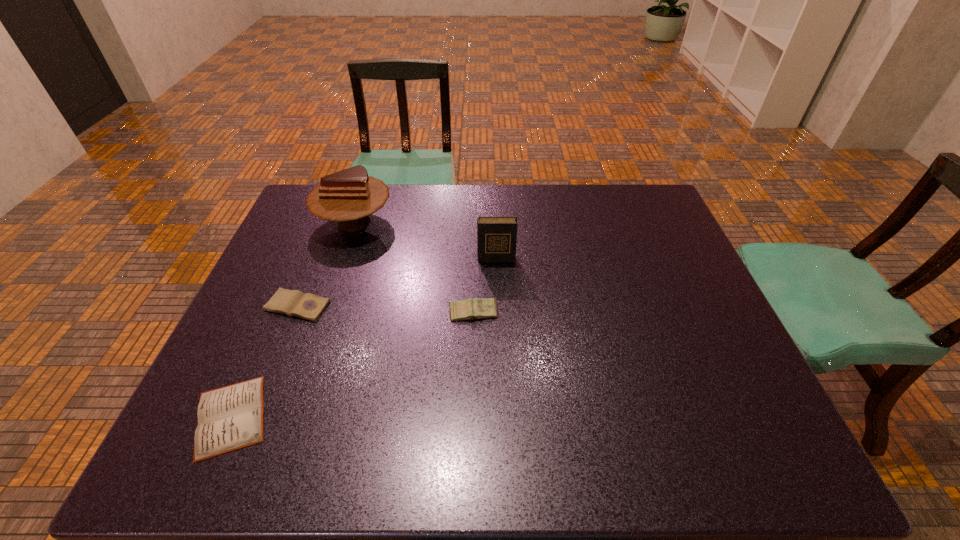
Find the location of a particular element. This screenshot has width=960, height=540. vacant area that lies between the nearest diary and the third tallest object is located at coordinates (352, 364).

The height and width of the screenshot is (540, 960). In order to click on free space between the second tallest diary and the second tallest object in this screenshot , I will do `click(485, 286)`.

You are a GUI agent. You are given a task and a screenshot of the screen. Output one action in this format:
    pyautogui.click(x=<x>, y=<y>)
    Task: Click on the free space that is in between the second tallest diary and the farthest diary
    The height and width of the screenshot is (540, 960).
    Given the screenshot: What is the action you would take?
    pos(485,286)

Where is `unoccupied area between the third shortest diary and the nearest diary`? The image size is (960, 540). unoccupied area between the third shortest diary and the nearest diary is located at coordinates (352, 364).

Locate an element on the screen. The height and width of the screenshot is (540, 960). vacant region between the farthest diary and the nearest diary is located at coordinates (364, 338).

Where is `empty space that is in between the third shortest diary and the nearest object`? empty space that is in between the third shortest diary and the nearest object is located at coordinates (352, 364).

You are a GUI agent. You are given a task and a screenshot of the screen. Output one action in this format:
    pyautogui.click(x=<x>, y=<y>)
    Task: Click on the unoccupied area between the nearest diary and the second tallest diary
    The image size is (960, 540).
    Given the screenshot: What is the action you would take?
    pyautogui.click(x=352, y=364)

Identify the location of object that stands as the fourth closest to the third shortest diary. Image resolution: width=960 pixels, height=540 pixels. (229, 418).

Locate which object ranks third in proximity to the farthest object. Please provide its 2D coordinates. Your answer should be formatted as a tuple, i.e. [(x, y)], where the tuple contains the x and y coordinates of a point satisfying the conditions above.

[(478, 308)]

Find the location of a particular element. The width and height of the screenshot is (960, 540). diary that is the fourth closest to the farthest object is located at coordinates (229, 418).